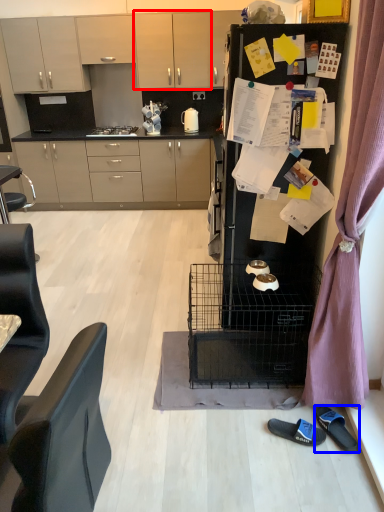
Question: Which object is further to the camera taking this photo, cabinetry (highlighted by a red box) or footwear (highlighted by a blue box)?

Choices:
 (A) cabinetry
 (B) footwear

Answer: (A)